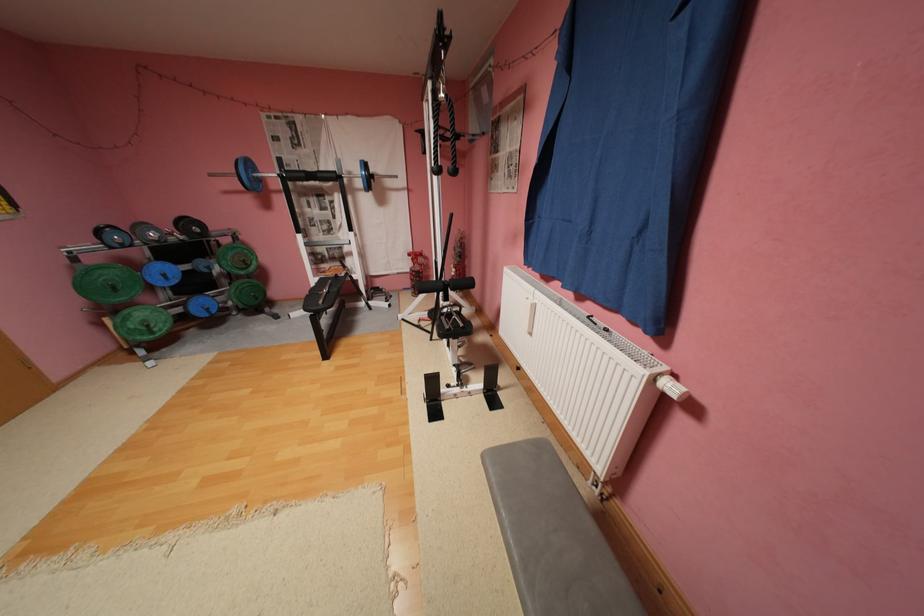
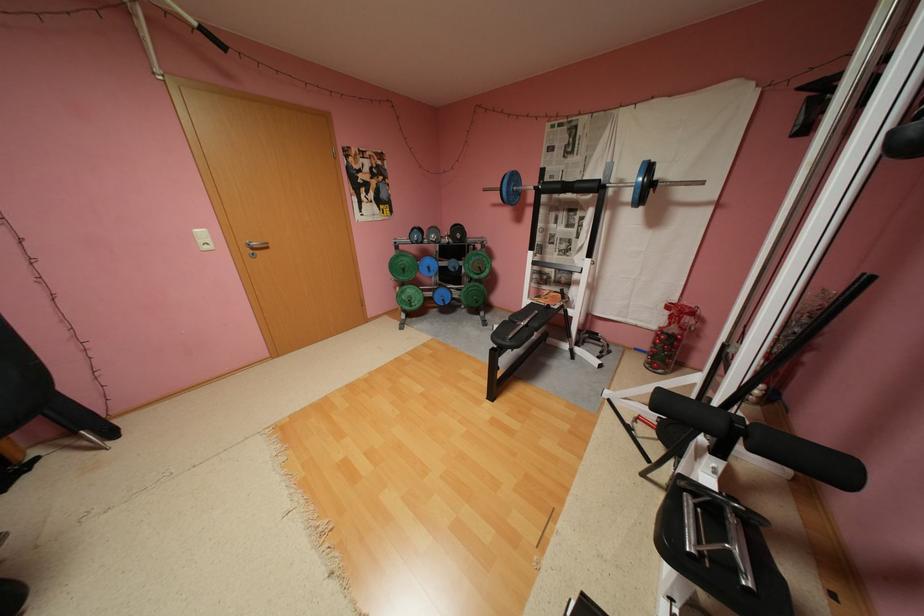
Where in the second image is the point corresponding to the point at 327,175 from the first image?

(586, 185)